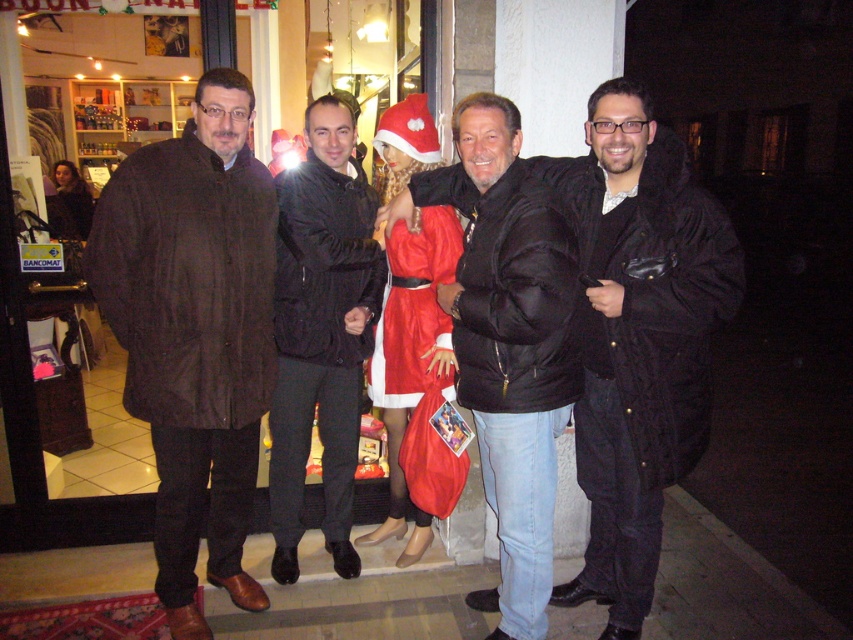
Which is in front, point (535, 177) or point (282, 262)?

Point (535, 177) is in front.

Does black puffy jacket at center have a greater width compared to black leather jacket at center?

Yes, black puffy jacket at center is wider than black leather jacket at center.

Is point (483, 196) closer to viewer compared to point (357, 412)?

Yes, it is in front of point (357, 412).

Where is `black puffy jacket at center`? The width and height of the screenshot is (853, 640). black puffy jacket at center is located at coordinates (508, 340).

Can you confirm if black fur coat at right is smaller than shiny red fabric santa at center?

Actually, black fur coat at right might be larger than shiny red fabric santa at center.

Between black fur coat at right and shiny red fabric santa at center, which one appears on the left side from the viewer's perspective?

shiny red fabric santa at center

Where is `black fur coat at right`? This screenshot has height=640, width=853. black fur coat at right is located at coordinates (637, 337).

The width and height of the screenshot is (853, 640). I want to click on black fur coat at right, so click(x=637, y=337).

Is point (119, 337) closer to camera compared to point (566, 352)?

No, (119, 337) is further to viewer.

Which is in front, point (230, 198) or point (540, 378)?

Point (540, 378)

The height and width of the screenshot is (640, 853). Find the location of `brown textured coat at left`. brown textured coat at left is located at coordinates (194, 332).